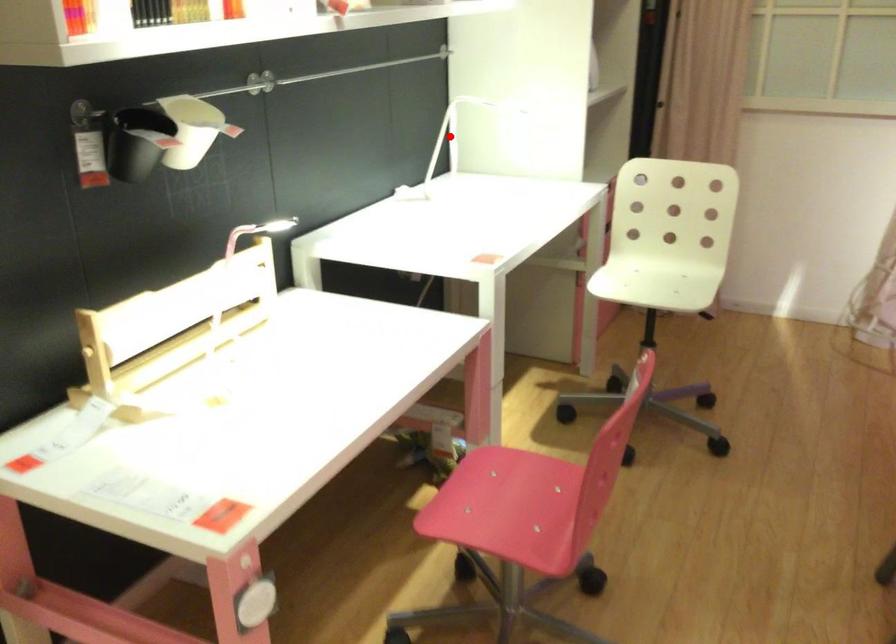
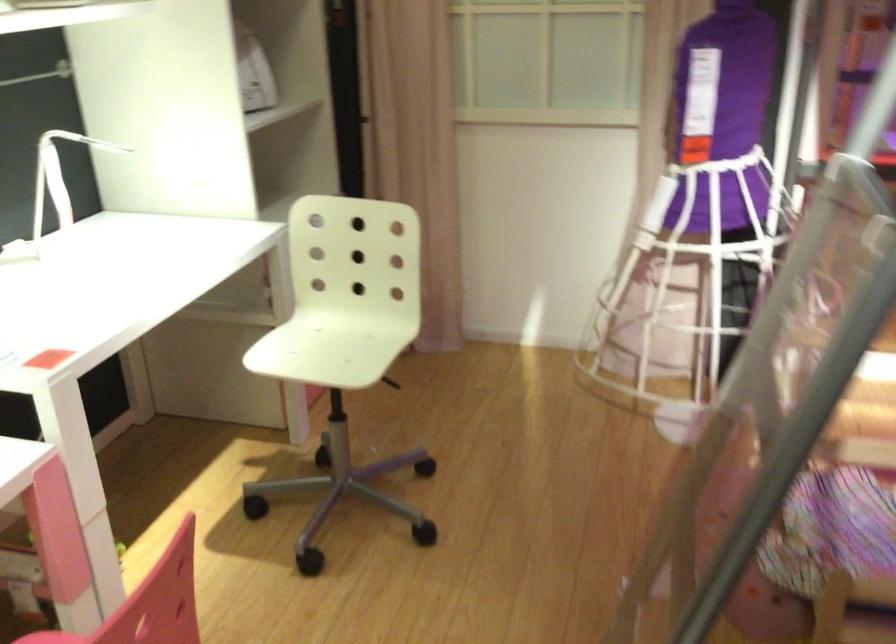
Locate, in the second image, the point that corresponds to the highlighted location in the first image.

(58, 176)